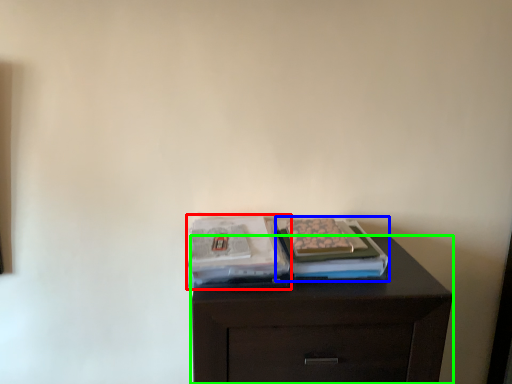
Question: Which object is the closest to the magazine (highlighted by a red box)? Choose among these: magazine (highlighted by a blue box) or chest of drawers (highlighted by a green box).

Choices:
 (A) magazine
 (B) chest of drawers

Answer: (A)